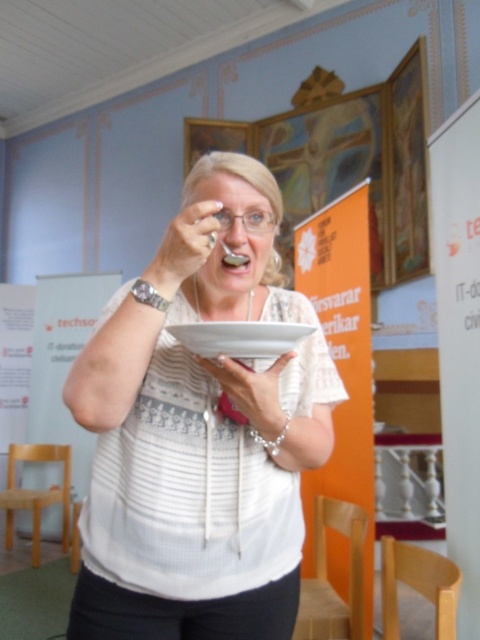
Question: Which of the following is the closest to the observer?

Choices:
 (A) white matte spoon at upper center
 (B) white matte bowl at center

Answer: (B)

Question: Based on their relative distances, which object is nearer to the white matte bowl at center?

Choices:
 (A) white matte hand at center
 (B) white matte spoon at upper center

Answer: (A)

Question: Is white matte bowl at center smaller than white matte hand at center?

Choices:
 (A) no
 (B) yes

Answer: (A)

Question: Does white matte bowl at center lie in front of white matte spoon at upper center?

Choices:
 (A) yes
 (B) no

Answer: (A)

Question: Which object appears farthest from the camera in this image?

Choices:
 (A) white matte hand at center
 (B) white matte bowl at center
 (C) white matte spoon at upper center
 (D) white glossy plate at center

Answer: (A)

Question: Is white matte bowl at center above white matte spoon at upper center?

Choices:
 (A) no
 (B) yes

Answer: (A)